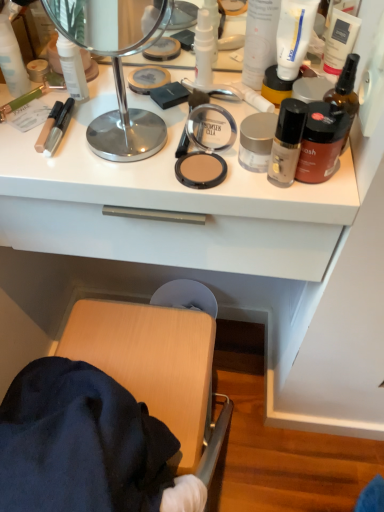
Where is `vacant space to the right of matte black concealer at left, which is the 2th toiletry from left to right`? The image size is (384, 512). vacant space to the right of matte black concealer at left, which is the 2th toiletry from left to right is located at coordinates (161, 134).